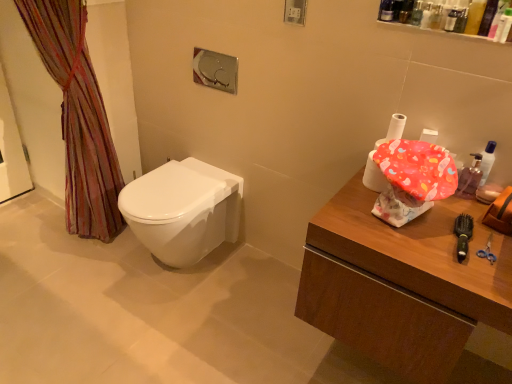
Where is `vacant space in front of green plastic brush at right`? vacant space in front of green plastic brush at right is located at coordinates (476, 276).